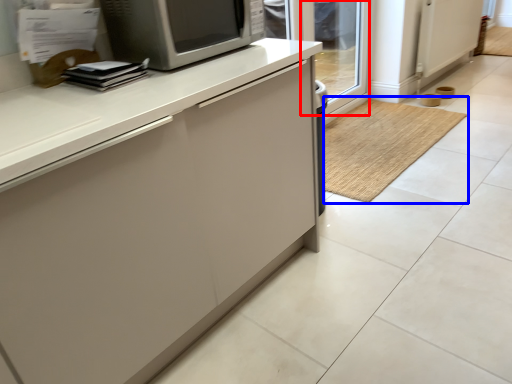
Question: Among these objects, which one is farthest to the camera, glass door (highlighted by a red box) or doormat (highlighted by a blue box)?

Choices:
 (A) glass door
 (B) doormat

Answer: (A)